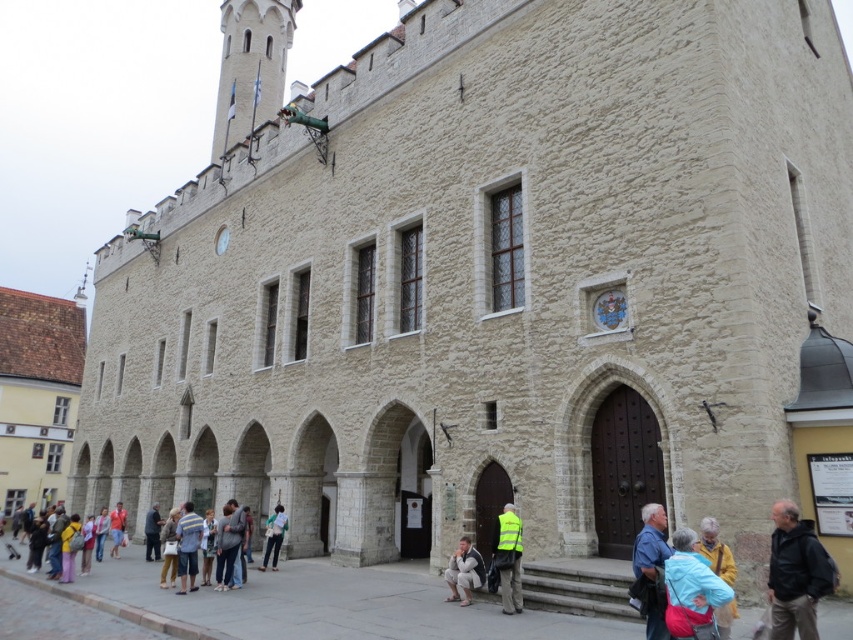
You are standing in front of the historic building and want to take a photo of both the brown stone church at left and the light blue shirt at lower left. Which object should you focus on first to ensure both are in the frame?

You should focus on the brown stone church at left first because it is closer to you than the light blue shirt at lower left, so adjusting the camera to include it will also capture the shirt in the background.

You are standing in front of the historic building and notice two points marked on its facade. The first point is at coordinate point (273, 92) and the second is at point (102, 516). If you want to touch both points starting from the nearest one, which point should you touch first?

You should touch point (273, 92) first because it is closer to you than point (102, 516), which is further away.